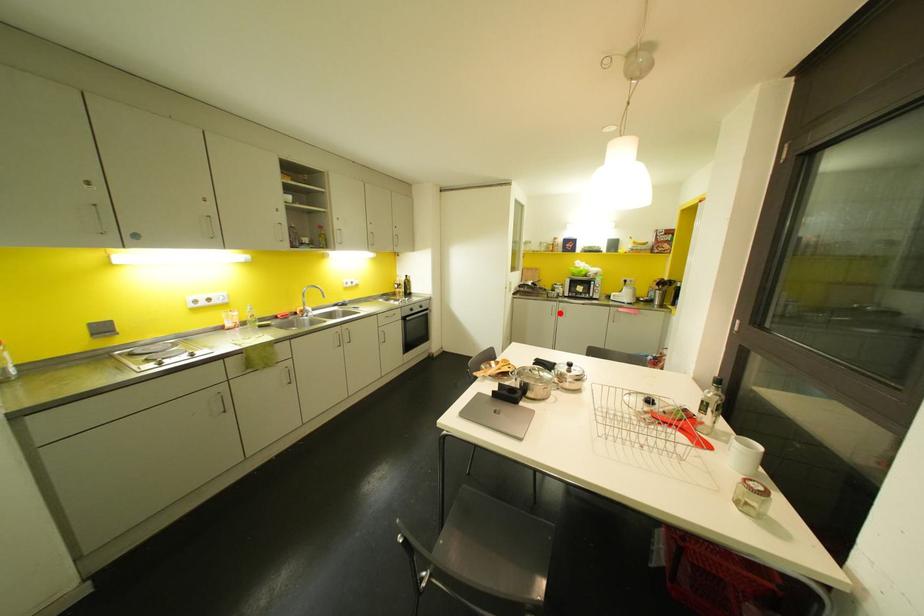
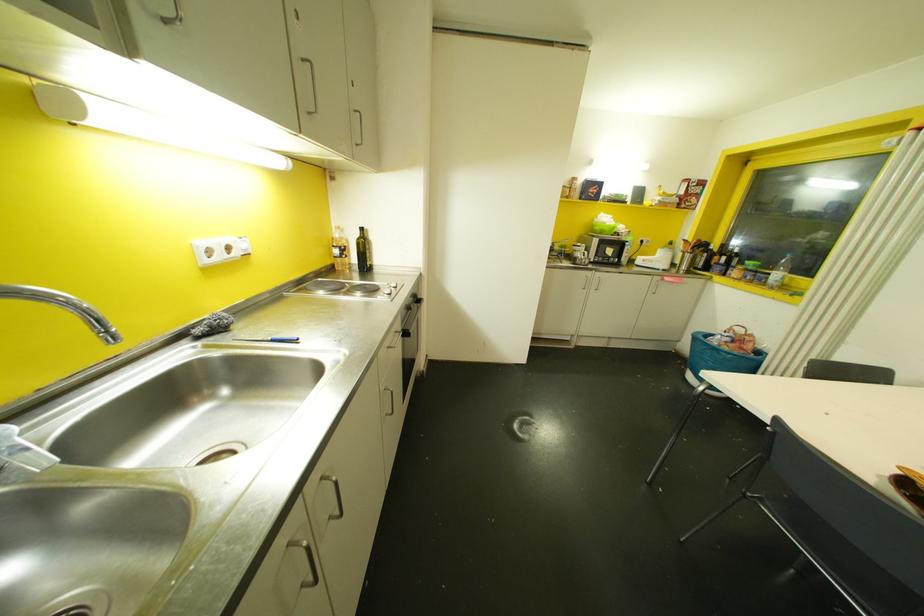
Find the pixel in the second image that matches the highlighted location in the first image.

(592, 286)